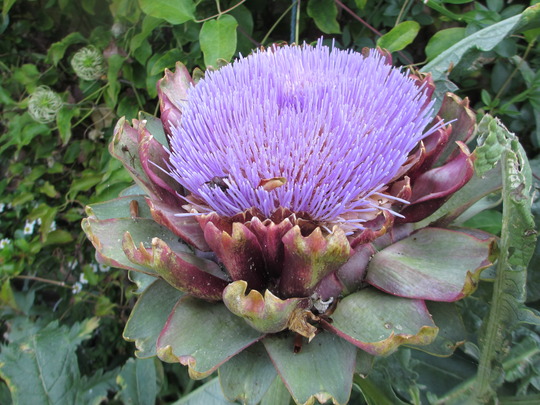
This screenshot has height=405, width=540. Find the location of `plant`. plant is located at coordinates (276, 291).